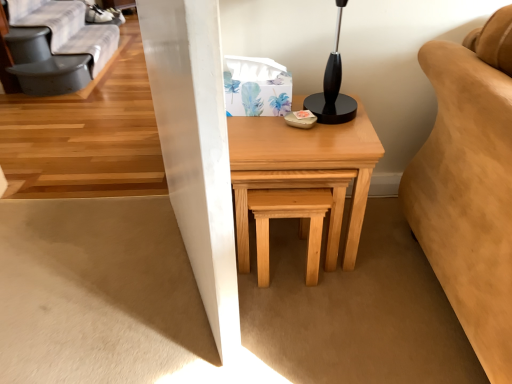
Find the location of `free space to the right of natural wood table at center`. free space to the right of natural wood table at center is located at coordinates (392, 247).